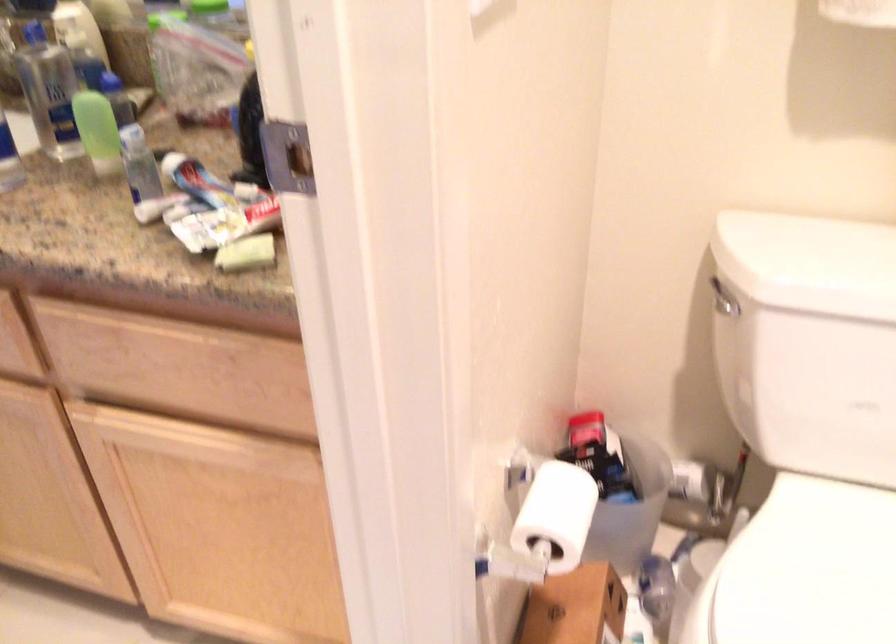
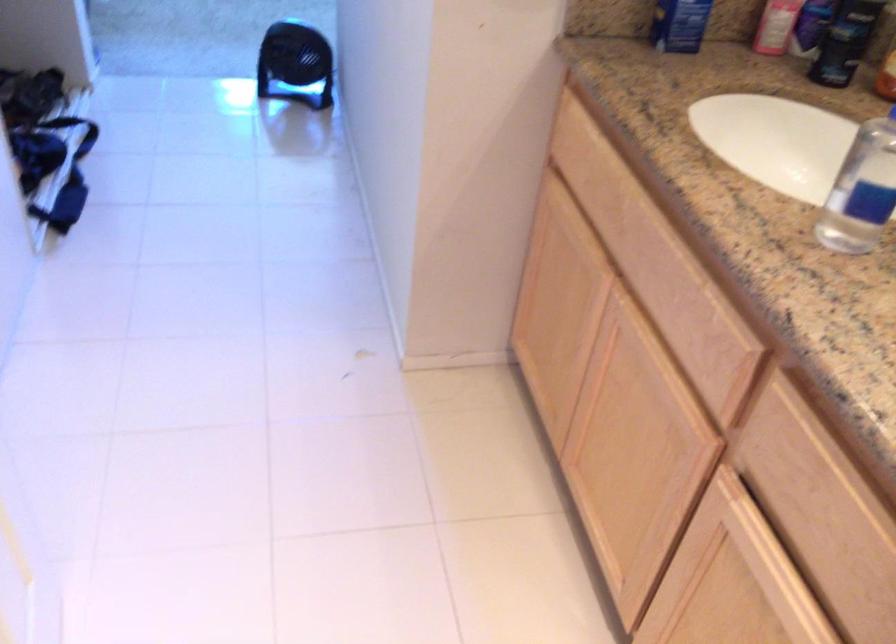
Locate, in the second image, the point that corresponds to the point at 142,422 in the first image.

(754, 536)